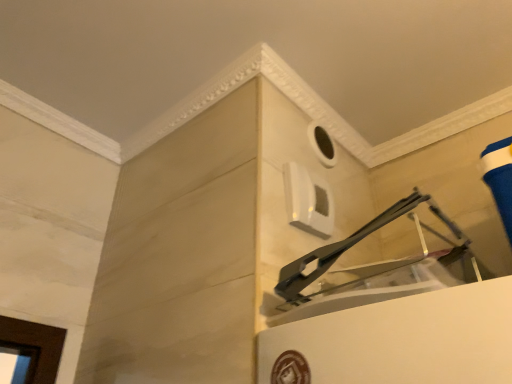
Question: Considering the relative positions of white matte hole at upper center and white plastic window at upper center in the image provided, is white matte hole at upper center behind white plastic window at upper center?

Choices:
 (A) no
 (B) yes

Answer: (B)

Question: Does white matte hole at upper center lie in front of white plastic window at upper center?

Choices:
 (A) no
 (B) yes

Answer: (A)

Question: Is white matte hole at upper center facing towards white plastic window at upper center?

Choices:
 (A) no
 (B) yes

Answer: (A)

Question: Can we say white matte hole at upper center lies outside white plastic window at upper center?

Choices:
 (A) yes
 (B) no

Answer: (A)

Question: Is white matte hole at upper center not near white plastic window at upper center?

Choices:
 (A) yes
 (B) no

Answer: (B)

Question: Is white matte hole at upper center bigger than white plastic window at upper center?

Choices:
 (A) no
 (B) yes

Answer: (A)

Question: Is white plastic window at upper center bigger than white matte hole at upper center?

Choices:
 (A) yes
 (B) no

Answer: (A)

Question: Is white plastic window at upper center shorter than white matte hole at upper center?

Choices:
 (A) no
 (B) yes

Answer: (A)

Question: From the image's perspective, is white plastic window at upper center above white matte hole at upper center?

Choices:
 (A) yes
 (B) no

Answer: (B)

Question: Is white plastic window at upper center oriented away from white matte hole at upper center?

Choices:
 (A) yes
 (B) no

Answer: (B)

Question: Does white plastic window at upper center have a smaller size compared to white matte hole at upper center?

Choices:
 (A) no
 (B) yes

Answer: (A)

Question: From a real-world perspective, is white plastic window at upper center under white matte hole at upper center?

Choices:
 (A) yes
 (B) no

Answer: (A)

Question: From a real-world perspective, relative to white matte hole at upper center, is white plastic window at upper center vertically above or below?

Choices:
 (A) below
 (B) above

Answer: (A)